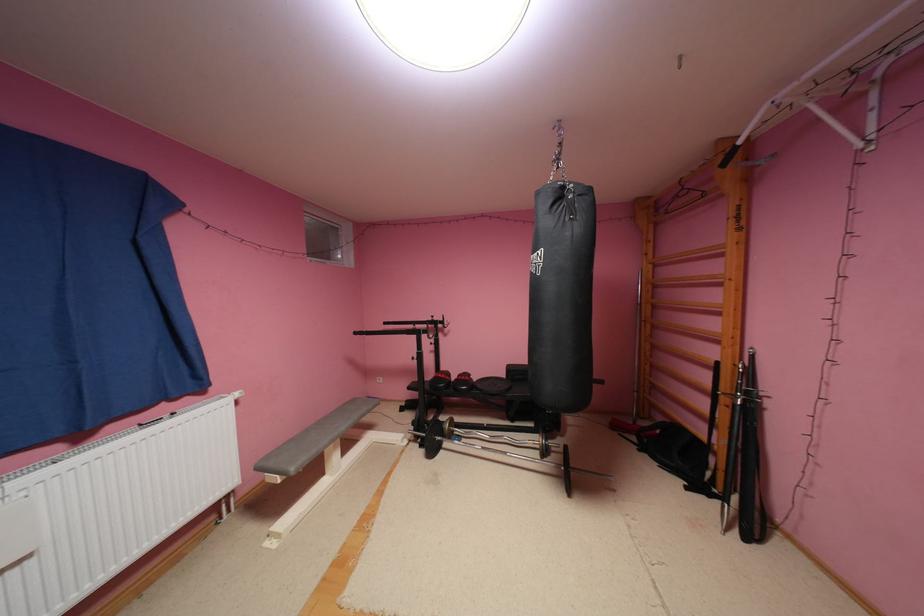
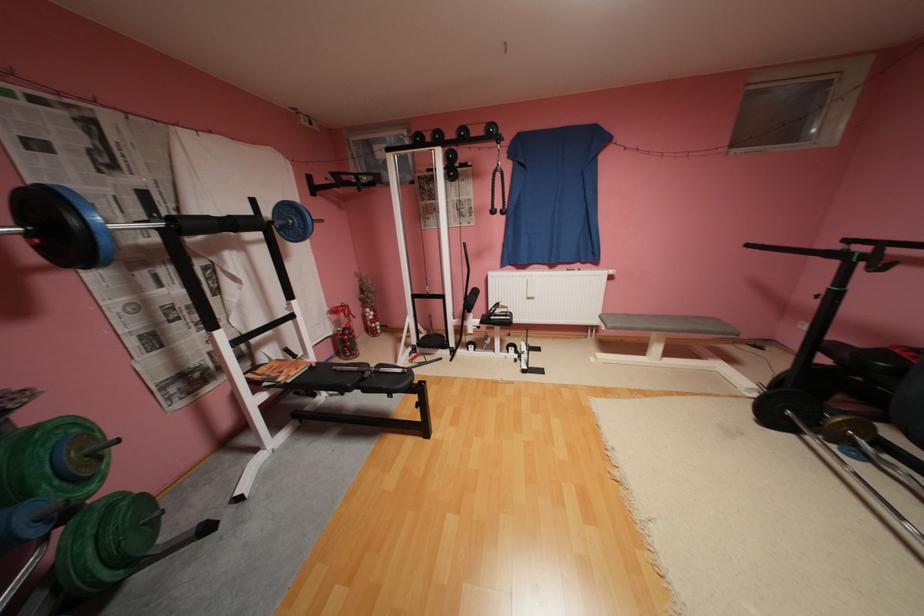
Find the pixel in the second image that matches the point at 345,434 in the first image.

(664, 326)